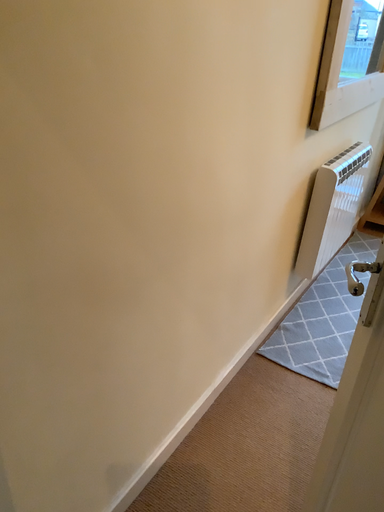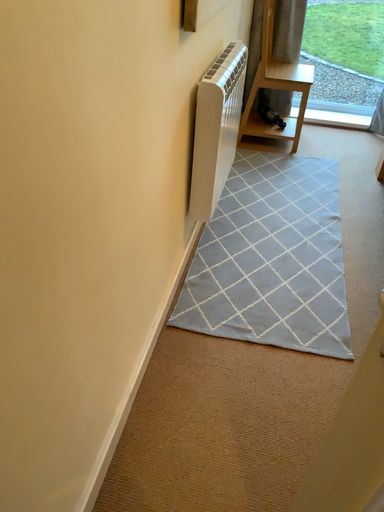
Question: Which way did the camera rotate in the video?

Choices:
 (A) rotated upward
 (B) rotated downward

Answer: (B)